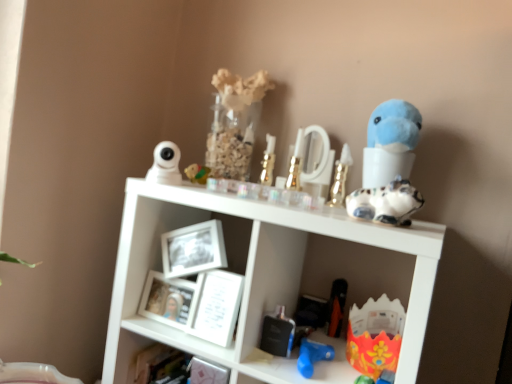
What do you see at coordinates (217, 306) in the screenshot?
I see `white glossy picture frame at center, the 1th picture frame in the right-to-left sequence` at bounding box center [217, 306].

Where is `gold metallic perfume bottle at center, which appears as the fifth toy when viewed from the left`? This screenshot has height=384, width=512. gold metallic perfume bottle at center, which appears as the fifth toy when viewed from the left is located at coordinates (296, 163).

The width and height of the screenshot is (512, 384). What do you see at coordinates (277, 333) in the screenshot?
I see `metallic silver perfume bottle at lower center, which is counted as the 7th toy, starting from the right` at bounding box center [277, 333].

Measure the distance between point (276, 316) and camera.

Point (276, 316) is 3.50 feet away from camera.

Locate an element on the screen. matte yellow toy at upper center, which ranks as the 2th toy in left-to-right order is located at coordinates (197, 173).

This screenshot has width=512, height=384. What do you see at coordinates (375, 336) in the screenshot?
I see `cardboard box at lower right, marked as the first toy in a right-to-left arrangement` at bounding box center [375, 336].

This screenshot has width=512, height=384. What are the coordinates of `black plastic toy at lower center, the 3th toy when ordered from right to left` in the screenshot? It's located at (336, 307).

From the image's perspective, is gold metallic perfume bottle at center, which ranks as the sixth toy in right-to-left order, beneath white plastic camera at upper left, which is counted as the 1th toy, starting from the left?

Incorrect, from the image's perspective, gold metallic perfume bottle at center, which ranks as the sixth toy in right-to-left order, is higher than white plastic camera at upper left, which is counted as the 1th toy, starting from the left.

Considering the sizes of objects gold metallic perfume bottle at center, which appears as the fifth toy when viewed from the left, and white plastic camera at upper left, the 10th toy when ordered from right to left, in the image provided, who is thinner, gold metallic perfume bottle at center, which appears as the fifth toy when viewed from the left, or white plastic camera at upper left, the 10th toy when ordered from right to left,?

With smaller width is gold metallic perfume bottle at center, which appears as the fifth toy when viewed from the left.

From a real-world perspective, is gold metallic perfume bottle at center, which appears as the fifth toy when viewed from the left, physically above white plastic camera at upper left, which is counted as the 1th toy, starting from the left?

Yes, from a real-world perspective, gold metallic perfume bottle at center, which appears as the fifth toy when viewed from the left, is on top of white plastic camera at upper left, which is counted as the 1th toy, starting from the left.

Between gold metallic perfume bottle at center, which appears as the fifth toy when viewed from the left, and white plastic camera at upper left, which is counted as the 1th toy, starting from the left, which one has more height?

With more height is gold metallic perfume bottle at center, which appears as the fifth toy when viewed from the left.

From a real-world perspective, is blue plastic toy at lower center, the fifth toy in the right-to-left sequence, physically located above or below speckled ceramic cat at upper right, which appears as the second toy when viewed from the right?

blue plastic toy at lower center, the fifth toy in the right-to-left sequence, is situated lower than speckled ceramic cat at upper right, which appears as the second toy when viewed from the right, in the real world.

Are blue plastic toy at lower center, the fifth toy in the right-to-left sequence, and speckled ceramic cat at upper right, the 9th toy from the left, making contact?

They are not placed beside each other.

Is blue plastic toy at lower center, the fifth toy in the right-to-left sequence, oriented towards speckled ceramic cat at upper right, the 9th toy from the left?

No, blue plastic toy at lower center, the fifth toy in the right-to-left sequence, is not aimed at speckled ceramic cat at upper right, the 9th toy from the left.

Can you tell me how much blue plastic toy at lower center, the fifth toy in the right-to-left sequence, and speckled ceramic cat at upper right, which appears as the second toy when viewed from the right, differ in facing direction?

The angular difference between blue plastic toy at lower center, the fifth toy in the right-to-left sequence, and speckled ceramic cat at upper right, which appears as the second toy when viewed from the right, is 2.5 degrees.

Looking at this image, considering the positions of objects metallic silver perfume bottle at lower center, which is the 4th toy in left-to-right order, and blue plush toy at upper right in the image provided, who is behind, metallic silver perfume bottle at lower center, which is the 4th toy in left-to-right order, or blue plush toy at upper right?

metallic silver perfume bottle at lower center, which is the 4th toy in left-to-right order, is further from the camera.

Is metallic silver perfume bottle at lower center, which is the 4th toy in left-to-right order, turned away from blue plush toy at upper right?

That's not correct — metallic silver perfume bottle at lower center, which is the 4th toy in left-to-right order, is not looking away from blue plush toy at upper right.

How far apart are metallic silver perfume bottle at lower center, which is counted as the 7th toy, starting from the right, and blue plush toy at upper right?

metallic silver perfume bottle at lower center, which is counted as the 7th toy, starting from the right, and blue plush toy at upper right are 17.79 inches apart.

Can you confirm if metallic silver perfume bottle at lower center, which is the 4th toy in left-to-right order, is wider than blue plush toy at upper right?

No.

Looking at this image, between white plastic camera at upper left, the 10th toy when ordered from right to left, and matte yellow toy at upper center, the 9th toy in the right-to-left sequence, which one has larger size?

Bigger between the two is white plastic camera at upper left, the 10th toy when ordered from right to left.

Is white plastic camera at upper left, which is counted as the 1th toy, starting from the left, wider or thinner than matte yellow toy at upper center, the 9th toy in the right-to-left sequence?

In the image, white plastic camera at upper left, which is counted as the 1th toy, starting from the left, appears to be more narrow than matte yellow toy at upper center, the 9th toy in the right-to-left sequence.

Which is in front, white plastic camera at upper left, the 10th toy when ordered from right to left, or matte yellow toy at upper center, which ranks as the 2th toy in left-to-right order?

white plastic camera at upper left, the 10th toy when ordered from right to left.

Can you tell me how much white plastic camera at upper left, which is counted as the 1th toy, starting from the left, and matte yellow toy at upper center, which ranks as the 2th toy in left-to-right order, differ in facing direction?

The facing directions of white plastic camera at upper left, which is counted as the 1th toy, starting from the left, and matte yellow toy at upper center, which ranks as the 2th toy in left-to-right order, are 0.00253 degrees apart.

Is black plastic toy at lower center, the 3th toy when ordered from right to left, looking in the opposite direction of gold metallic perfume bottle at upper center, which is the seventh toy in left-to-right order?

No, gold metallic perfume bottle at upper center, which is the seventh toy in left-to-right order, is not at the back of black plastic toy at lower center, the 3th toy when ordered from right to left.

Considering the sizes of black plastic toy at lower center, arranged as the eighth toy when viewed from the left, and gold metallic perfume bottle at upper center, placed as the fourth toy when sorted from right to left, in the image, is black plastic toy at lower center, arranged as the eighth toy when viewed from the left, taller or shorter than gold metallic perfume bottle at upper center, placed as the fourth toy when sorted from right to left,?

In the image, black plastic toy at lower center, arranged as the eighth toy when viewed from the left, appears to be shorter than gold metallic perfume bottle at upper center, placed as the fourth toy when sorted from right to left.

Based on their positions, is black plastic toy at lower center, arranged as the eighth toy when viewed from the left, located to the left or right of gold metallic perfume bottle at upper center, placed as the fourth toy when sorted from right to left?

Based on their positions, black plastic toy at lower center, arranged as the eighth toy when viewed from the left, is located to the right of gold metallic perfume bottle at upper center, placed as the fourth toy when sorted from right to left.

From the picture: Looking at their sizes, would you say black plastic toy at lower center, arranged as the eighth toy when viewed from the left, is wider or thinner than gold metallic perfume bottle at upper center, which is the seventh toy in left-to-right order?

Considering their sizes, black plastic toy at lower center, arranged as the eighth toy when viewed from the left, looks broader than gold metallic perfume bottle at upper center, which is the seventh toy in left-to-right order.

From the picture: From a real-world perspective, is gold metallic perfume bottle at center, which appears as the fifth toy when viewed from the left, positioned above or below cardboard box at lower right, marked as the first toy in a right-to-left arrangement?

gold metallic perfume bottle at center, which appears as the fifth toy when viewed from the left, is above cardboard box at lower right, marked as the first toy in a right-to-left arrangement.

From the image's perspective, which one is positioned higher, gold metallic perfume bottle at center, which ranks as the sixth toy in right-to-left order, or cardboard box at lower right, the tenth toy when ordered from left to right?

From the image's view, gold metallic perfume bottle at center, which ranks as the sixth toy in right-to-left order, is above.

Which is in front, gold metallic perfume bottle at center, which appears as the fifth toy when viewed from the left, or cardboard box at lower right, the tenth toy when ordered from left to right?

cardboard box at lower right, the tenth toy when ordered from left to right, is in front.

Which is farther, [405,126] or [199,277]?

The point [199,277] is farther from the camera.

Is the position of blue plush toy at upper right more distant than that of white glossy picture frame at center, the second picture frame viewed from the left?

No, blue plush toy at upper right is in front of white glossy picture frame at center, the second picture frame viewed from the left.

Is blue plush toy at upper right situated inside white glossy picture frame at center, the second picture frame viewed from the left, or outside?

blue plush toy at upper right is not enclosed by white glossy picture frame at center, the second picture frame viewed from the left.

From the image's perspective, which toy is the 1st one above the white plastic camera at upper left, the 10th toy when ordered from right to left? Please provide its 2D coordinates.

[(296, 163)]

From a real-world perspective, which toy is the 5th one underneath the speckled ceramic cat at upper right, which appears as the second toy when viewed from the right? Please provide its 2D coordinates.

[(312, 356)]

When comparing their distances from white matte picture frame at center, arranged as the first picture frame when viewed from the left, does matte yellow toy at upper center, the 9th toy in the right-to-left sequence, or blue plastic toy at lower center, the fifth toy in the right-to-left sequence, seem further?

blue plastic toy at lower center, the fifth toy in the right-to-left sequence.

Based on their spatial positions, is black plastic toy at lower center, the 3th toy when ordered from right to left, or white matte picture frame at center, arranged as the first picture frame when viewed from the left, closer to gold metallic perfume bottle at center, which ranks as the sixth toy in right-to-left order?

black plastic toy at lower center, the 3th toy when ordered from right to left, lies closer to gold metallic perfume bottle at center, which ranks as the sixth toy in right-to-left order, than the other object.

Consider the image. Looking at the image, which one is located further to gold metallic perfume bottle at upper center, which is the seventh toy in left-to-right order, cardboard box at lower right, the tenth toy when ordered from left to right, or black plastic toy at lower center, arranged as the eighth toy when viewed from the left?

cardboard box at lower right, the tenth toy when ordered from left to right, is further to gold metallic perfume bottle at upper center, which is the seventh toy in left-to-right order.

Estimate the real-world distances between objects in this image. Which object is closer to matte yellow toy at upper center, the 9th toy in the right-to-left sequence, cardboard box at lower right, the tenth toy when ordered from left to right, or blue plastic toy at lower center, the 6th toy in the left-to-right sequence?

blue plastic toy at lower center, the 6th toy in the left-to-right sequence, is positioned closer to the anchor matte yellow toy at upper center, the 9th toy in the right-to-left sequence.

Which object lies nearer to the anchor point matte yellow toy at upper center, the 9th toy in the right-to-left sequence, gold metallic perfume bottle at center, which appears as the fifth toy when viewed from the left, or white matte picture frame at center, arranged as the first picture frame when viewed from the left?

gold metallic perfume bottle at center, which appears as the fifth toy when viewed from the left, lies closer to matte yellow toy at upper center, the 9th toy in the right-to-left sequence, than the other object.

Based on their spatial positions, is blue plastic toy at lower center, the 6th toy in the left-to-right sequence, or white plastic camera at upper left, the 10th toy when ordered from right to left, closer to blue plush toy at upper right?

Among the two, blue plastic toy at lower center, the 6th toy in the left-to-right sequence, is located nearer to blue plush toy at upper right.

Estimate the real-world distances between objects in this image. Which object is further from matte yellow toy at upper center, the 9th toy in the right-to-left sequence, black plastic toy at lower center, arranged as the eighth toy when viewed from the left, or gold metallic candlestick at center, which is the 3th toy from left to right?

black plastic toy at lower center, arranged as the eighth toy when viewed from the left.

Looking at the image, which one is located further to white plastic camera at upper left, which is counted as the 1th toy, starting from the left, white matte picture frame at center, arranged as the first picture frame when viewed from the left, or gold metallic perfume bottle at upper center, placed as the fourth toy when sorted from right to left?

gold metallic perfume bottle at upper center, placed as the fourth toy when sorted from right to left, lies further to white plastic camera at upper left, which is counted as the 1th toy, starting from the left, than the other object.

Identify the location of picture frame between matte yellow toy at upper center, which ranks as the 2th toy in left-to-right order, and white glossy picture frame at center, the 1th picture frame in the right-to-left sequence, in the up-down direction. (168, 300).

Where is `picture frame between white plastic camera at upper left, which is counted as the 1th toy, starting from the left, and white glossy picture frame at center, the second picture frame viewed from the left, in the vertical direction`? The image size is (512, 384). picture frame between white plastic camera at upper left, which is counted as the 1th toy, starting from the left, and white glossy picture frame at center, the second picture frame viewed from the left, in the vertical direction is located at coordinates (168, 300).

The width and height of the screenshot is (512, 384). Identify the location of picture frame situated between matte yellow toy at upper center, which ranks as the 2th toy in left-to-right order, and black plastic toy at lower center, arranged as the eighth toy when viewed from the left, from left to right. (217, 306).

This screenshot has width=512, height=384. I want to click on figurine that lies between gold metallic candlestick at center, which is the 3th toy from left to right, and black plastic toy at lower center, the 3th toy when ordered from right to left, from top to bottom, so coord(390,145).